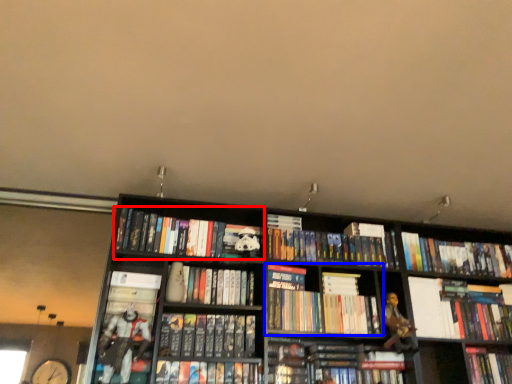
Question: Among these objects, which one is nearest to the camera, book (highlighted by a red box) or book (highlighted by a blue box)?

Choices:
 (A) book
 (B) book

Answer: (B)